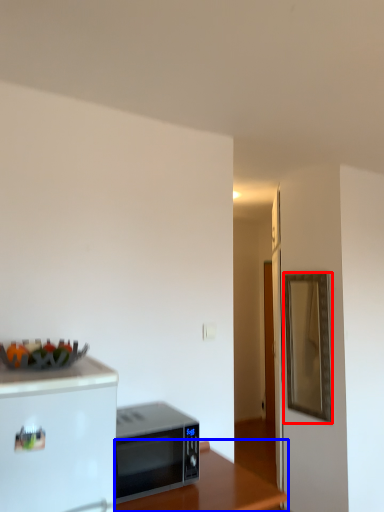
Question: Which point is closer to the camera, mirror (highlighted by a red box) or table (highlighted by a blue box)?

Choices:
 (A) mirror
 (B) table

Answer: (B)